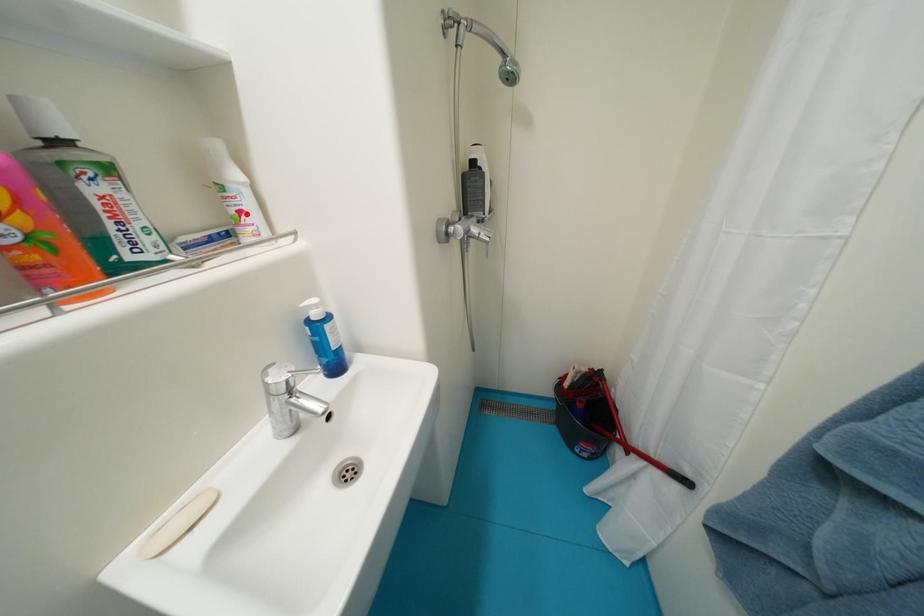
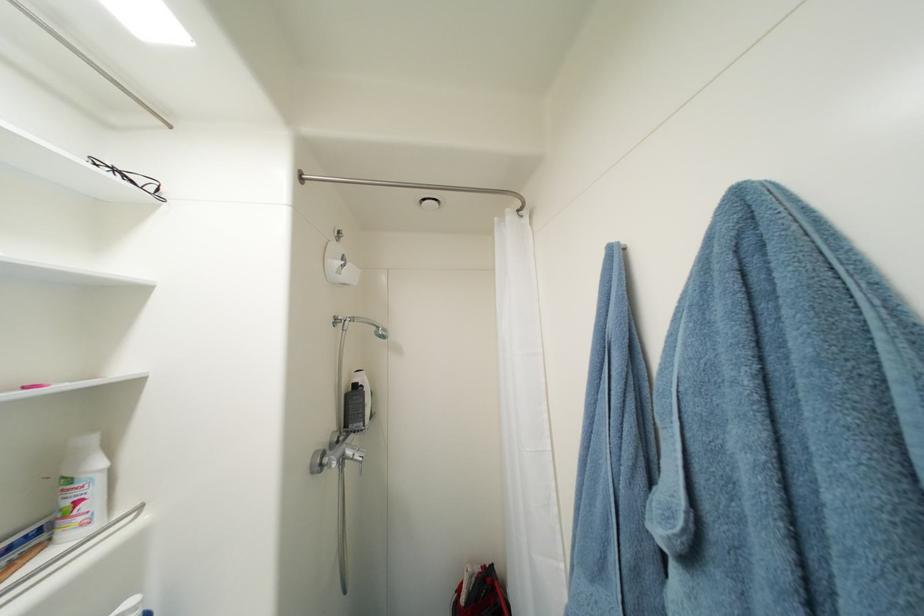
Find the pixel in the second image that matches the highlighted location in the first image.

(84, 504)